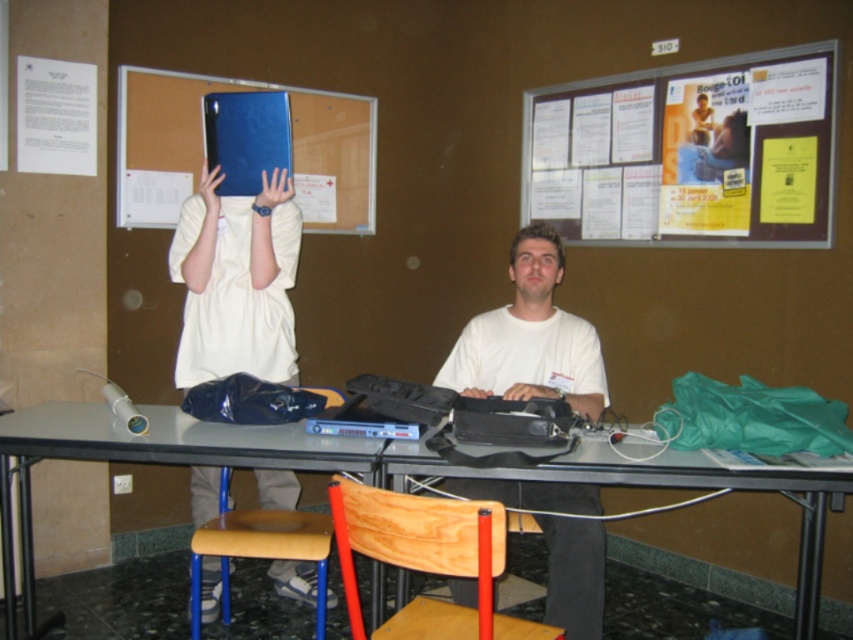
Question: Estimate the real-world distances between objects in this image. Which object is closer to the white paper at upper left?

Choices:
 (A) matte gray table at center
 (B) matte plastic hand at upper center
 (C) white matte shirt at upper left
 (D) wooden chair at center

Answer: (C)

Question: Considering the real-world distances, which object is closest to the matte plastic hand at upper center?

Choices:
 (A) blue leather folder at upper center
 (B) matte gray table at center
 (C) blue plastic folder at upper center

Answer: (A)

Question: Can you confirm if white matte shirt at upper left is smaller than white paper at upper left?

Choices:
 (A) yes
 (B) no

Answer: (B)

Question: From the image, what is the correct spatial relationship of matte gray table at center in relation to matte plastic hand at upper center?

Choices:
 (A) above
 (B) below

Answer: (B)

Question: Which object is farther from the camera taking this photo?

Choices:
 (A) matte blue folder at upper left
 (B) white paper at upper left
 (C) blue leather folder at upper center

Answer: (B)

Question: Can you confirm if metallic gray table at center is positioned to the left of blue leather folder at upper center?

Choices:
 (A) no
 (B) yes

Answer: (A)